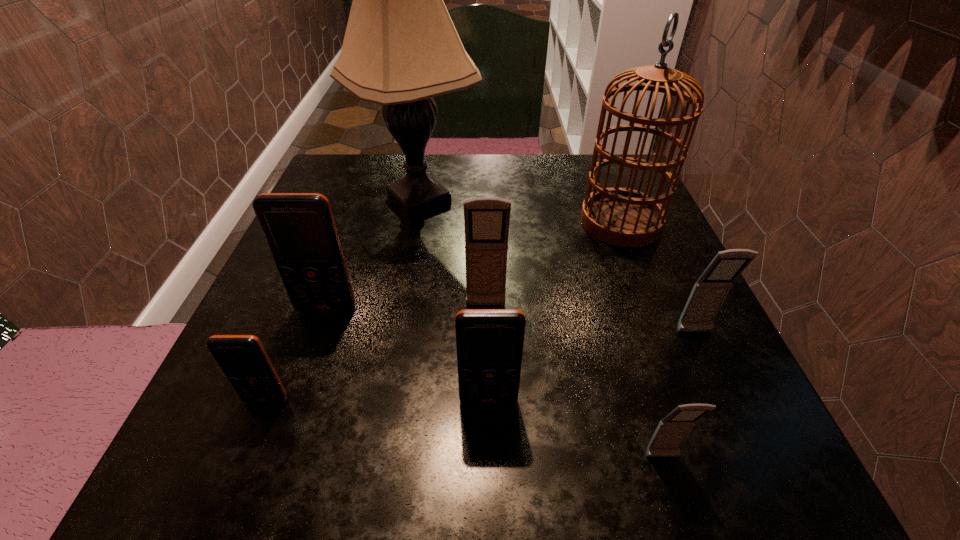
You are a GUI agent. You are given a task and a screenshot of the screen. Output one action in this format:
    pyautogui.click(x=<x>, y=<y>)
    Task: Click on the tallest object
    The height and width of the screenshot is (540, 960).
    Given the screenshot: What is the action you would take?
    pyautogui.click(x=400, y=49)

This screenshot has width=960, height=540. What are the coordinates of `lamp` in the screenshot? It's located at (400, 49).

Identify the location of birdcage. The image size is (960, 540). (624, 217).

In order to click on the leftmost gray cellular telephone in this screenshot , I will do `click(486, 219)`.

The width and height of the screenshot is (960, 540). Identify the location of the farthest gray cellular telephone. (486, 219).

The height and width of the screenshot is (540, 960). What are the coordinates of `the farthest orange cellular telephone` in the screenshot? It's located at (299, 228).

Locate an element on the screen. This screenshot has height=540, width=960. the second farthest gray cellular telephone is located at coordinates pyautogui.click(x=709, y=292).

Locate an element on the screen. The width and height of the screenshot is (960, 540). the second biggest gray cellular telephone is located at coordinates (709, 292).

The height and width of the screenshot is (540, 960). In order to click on the second biggest orange cellular telephone in this screenshot , I will do `click(489, 342)`.

The height and width of the screenshot is (540, 960). Identify the location of the smallest orange cellular telephone. (242, 358).